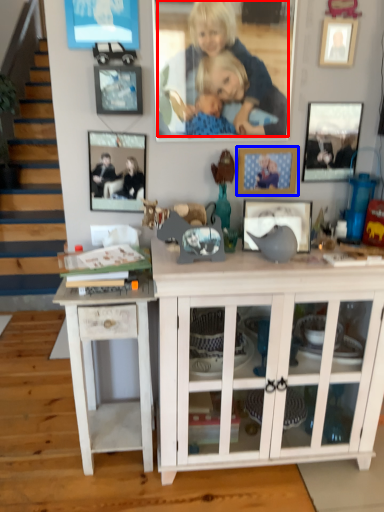
Question: Which of the following is the farthest to the observer, person (highlighted by a red box) or picture frame (highlighted by a blue box)?

Choices:
 (A) person
 (B) picture frame

Answer: (B)